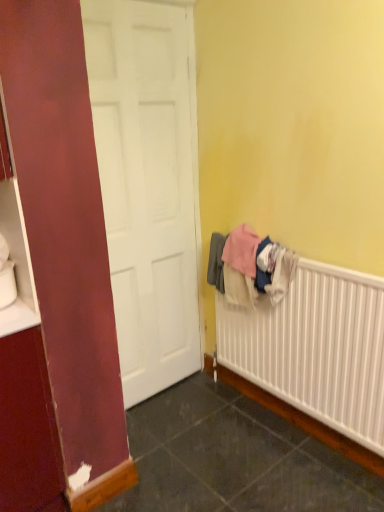
Question: Does white textured radiator at lower right have a greater width compared to soft cotton towels at right?

Choices:
 (A) no
 (B) yes

Answer: (B)

Question: Considering the relative positions of white textured radiator at lower right and soft cotton towels at right in the image provided, is white textured radiator at lower right to the left of soft cotton towels at right from the viewer's perspective?

Choices:
 (A) yes
 (B) no

Answer: (B)

Question: Does white textured radiator at lower right have a lesser width compared to soft cotton towels at right?

Choices:
 (A) yes
 (B) no

Answer: (B)

Question: Is the depth of white textured radiator at lower right less than that of soft cotton towels at right?

Choices:
 (A) yes
 (B) no

Answer: (A)

Question: Is white textured radiator at lower right bigger than soft cotton towels at right?

Choices:
 (A) no
 (B) yes

Answer: (B)

Question: Is white textured radiator at lower right taller than soft cotton towels at right?

Choices:
 (A) yes
 (B) no

Answer: (A)

Question: Considering the relative positions of soft cotton towels at right and white textured radiator at lower right in the image provided, is soft cotton towels at right in front of white textured radiator at lower right?

Choices:
 (A) no
 (B) yes

Answer: (A)

Question: Considering the relative sizes of soft cotton towels at right and white textured radiator at lower right in the image provided, is soft cotton towels at right shorter than white textured radiator at lower right?

Choices:
 (A) no
 (B) yes

Answer: (B)

Question: From the image's perspective, does soft cotton towels at right appear higher than white textured radiator at lower right?

Choices:
 (A) yes
 (B) no

Answer: (A)

Question: Is soft cotton towels at right outside of white textured radiator at lower right?

Choices:
 (A) yes
 (B) no

Answer: (B)

Question: Can you see soft cotton towels at right touching white textured radiator at lower right?

Choices:
 (A) no
 (B) yes

Answer: (A)

Question: Is soft cotton towels at right at the left side of white textured radiator at lower right?

Choices:
 (A) no
 (B) yes

Answer: (B)

Question: Do you think white textured radiator at lower right is within soft cotton towels at right, or outside of it?

Choices:
 (A) inside
 (B) outside

Answer: (B)